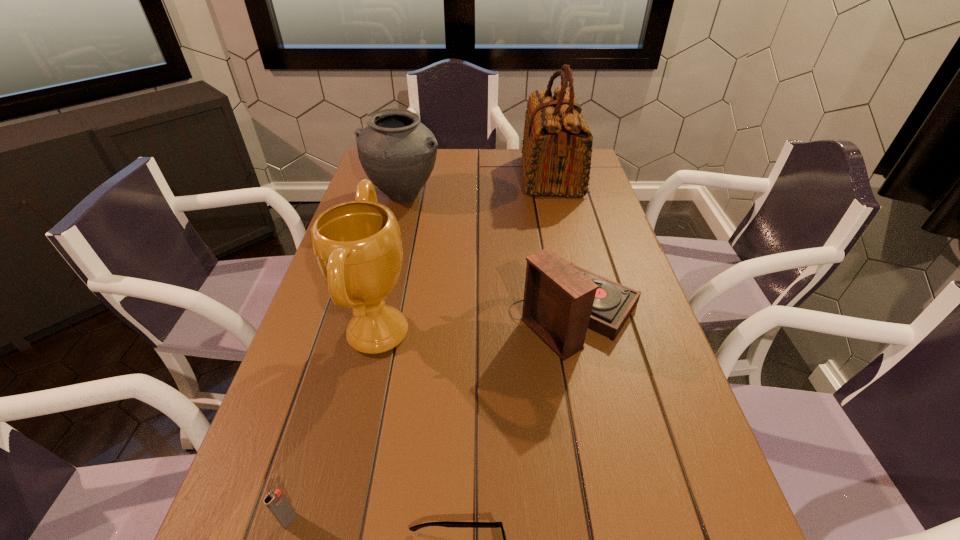
You are a GUI agent. You are given a task and a screenshot of the screen. Output one action in this format:
    pyautogui.click(x=<x>, y=<y>)
    Task: Click on the vacant space located 0.190m on the right of the urn
    The width and height of the screenshot is (960, 540).
    Given the screenshot: What is the action you would take?
    pyautogui.click(x=501, y=195)

The height and width of the screenshot is (540, 960). Find the location of `free region located 0.270m on the left of the phonograph record`. free region located 0.270m on the left of the phonograph record is located at coordinates (395, 313).

I want to click on vacant space located 0.110m on the back of the fifth tallest object, so click(311, 447).

Identify the location of shopping bag that is at the far edge. (557, 147).

Locate an element on the screen. urn that is at the far edge is located at coordinates (397, 152).

The image size is (960, 540). Find the location of `award at the left edge`. award at the left edge is located at coordinates (357, 244).

You are a GUI agent. You are given a task and a screenshot of the screen. Output one action in this format:
    pyautogui.click(x=<x>, y=<y>)
    Task: Click on the urn positioned at the left edge
    The height and width of the screenshot is (540, 960).
    Given the screenshot: What is the action you would take?
    pyautogui.click(x=397, y=152)

Locate an element on the screen. igniter that is at the left edge is located at coordinates (276, 502).

Image resolution: width=960 pixels, height=540 pixels. I want to click on shopping bag that is positioned at the right edge, so click(x=557, y=147).

Where is `phonograph record located in the right edge section of the desktop`? The height and width of the screenshot is (540, 960). phonograph record located in the right edge section of the desktop is located at coordinates (561, 301).